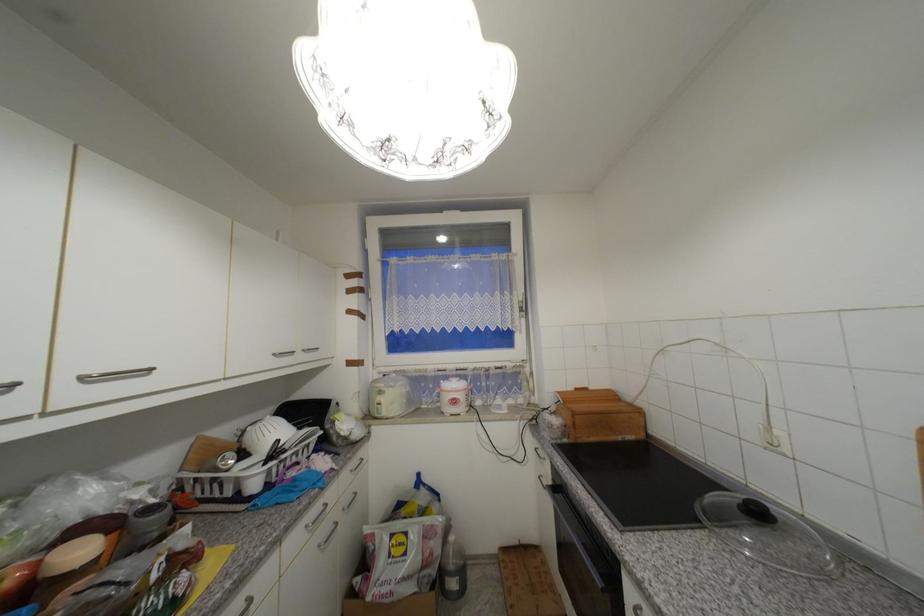
I want to click on white window handle, so click(x=527, y=302).